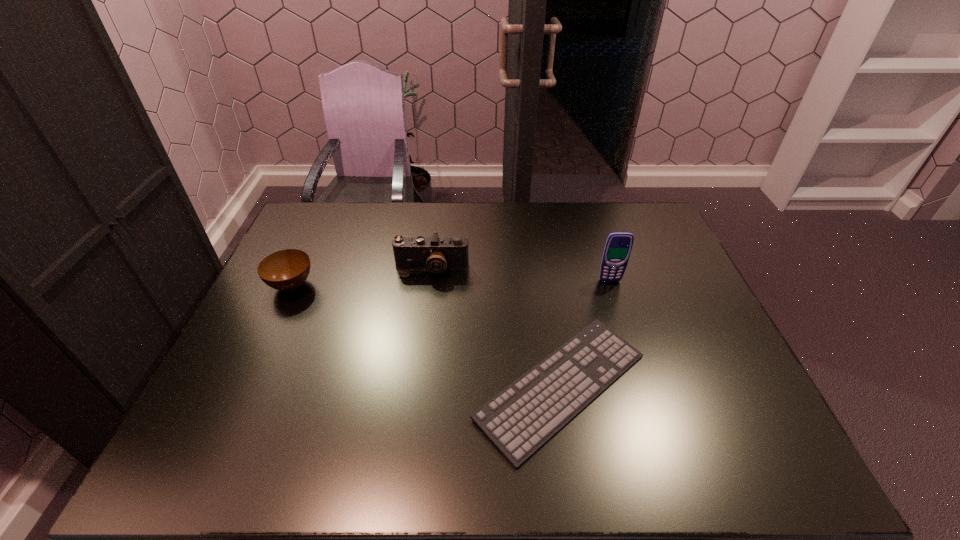
At what (x,y) coordinates should I click in order to perform the action: click on vacant space that's between the camera and the computer keyboard. Please return your answer as a coordinate pair (x, y). Looking at the image, I should click on (496, 328).

I want to click on free space between the bowl and the second object from left to right, so click(x=362, y=277).

Locate an element on the screen. free space between the camera and the cellular telephone is located at coordinates (521, 275).

Locate an element on the screen. Image resolution: width=960 pixels, height=540 pixels. free space between the leftmost object and the tallest object is located at coordinates (450, 283).

Where is `blank region between the bowl and the tallest object`? blank region between the bowl and the tallest object is located at coordinates (450, 283).

You are a GUI agent. You are given a task and a screenshot of the screen. Output one action in this format:
    pyautogui.click(x=<x>, y=<y>)
    Task: Click on the unoccupied position between the bowl and the nearest object
    
    Given the screenshot: What is the action you would take?
    pyautogui.click(x=426, y=336)

Where is `free space between the nearest object and the bowl`? free space between the nearest object and the bowl is located at coordinates point(426,336).

You are a GUI agent. You are given a task and a screenshot of the screen. Output one action in this format:
    pyautogui.click(x=<x>, y=<y>)
    Task: Click on the vacant space that's between the leftmost object and the shortest object
    The width and height of the screenshot is (960, 540).
    Given the screenshot: What is the action you would take?
    pyautogui.click(x=426, y=336)

The image size is (960, 540). I want to click on free space between the leftmost object and the tallest object, so click(x=450, y=283).

Identify the location of object identified as the third closest to the leftmost object. The image size is (960, 540). (618, 245).